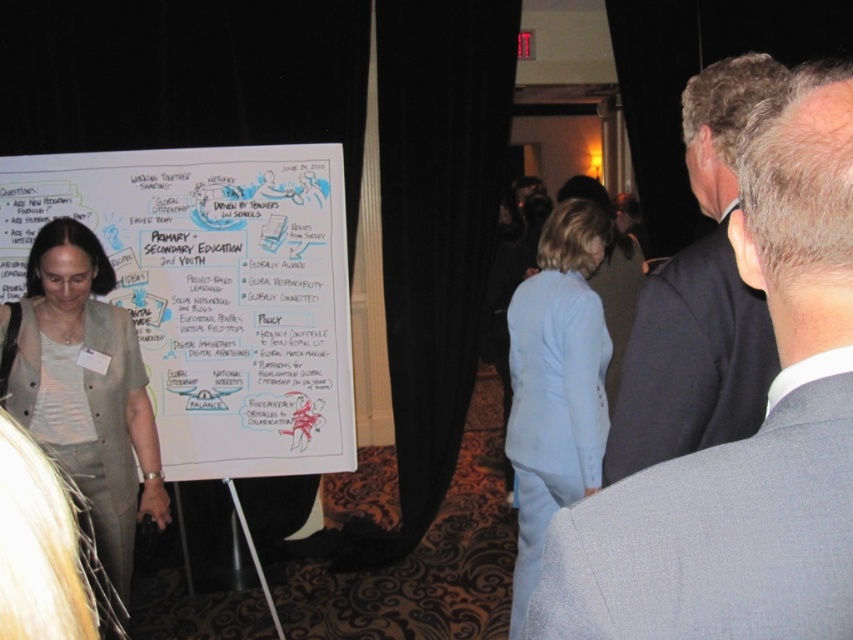
You are organizing a conference and need to arrange seating for two attendees wearing a light beige fabric jacket at left and a light blue fabric suit at center. Based on their positions in the image, which attendee should sit on the left side of the table to maintain their relative positioning?

The light beige fabric jacket at left should sit on the left side of the table since it is already positioned to the left of the light blue fabric suit at center in the image.

You are organizing a panel discussion and need to seat the participants. The light beige fabric jacket at left and the light blue fabric suit at center are two attendees. Based on their clothing sizes, which attendee might require a larger chair?

The light blue fabric suit at center requires a larger chair because it is bigger in size compared to the light beige fabric jacket at left.

You are organizing a presentation and need to choose between the gray suit at center and the light blue fabric suit at center. Based on their sizes, which one would be more appropriate if you want a wider option?

The light blue fabric suit at center is wider than the gray suit at center, so it would be more appropriate for a wider option.